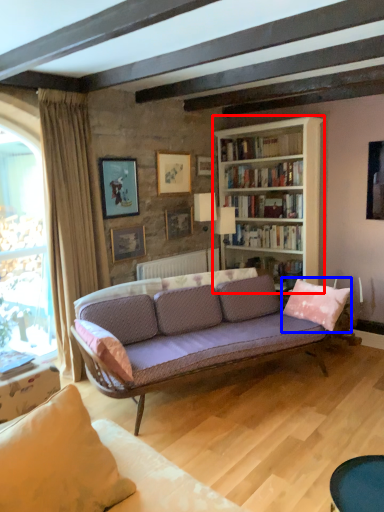
Question: Among these objects, which one is nearest to the camera, bookcase (highlighted by a red box) or pillow (highlighted by a blue box)?

Choices:
 (A) bookcase
 (B) pillow

Answer: (B)